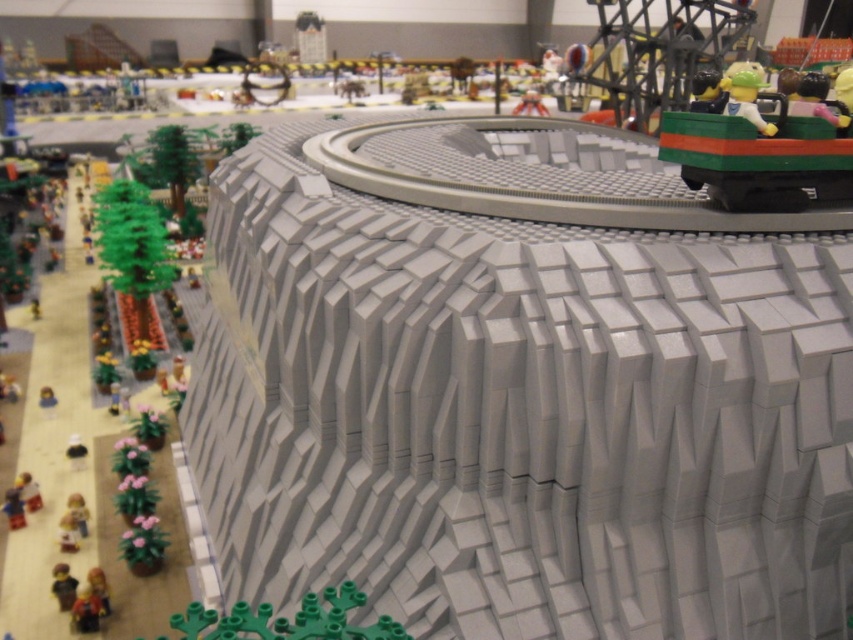
You are a visitor at a LEGO exhibition and see the green plastic car at upper right and the green matte figure at upper right. Which object is taller in this LEGO scene?

The green plastic car at upper right is taller than the green matte figure at upper right according to the description.

In the scene shown: You are examining a LEGO diorama and notice two points marked in the scene. The first point is at coordinates point (x=701, y=116) and the second is at point (x=534, y=108). Based on the LEGO model layout, which point is nearer to your viewpoint as you look at the image?

Point (x=701, y=116) is closer to the camera than point (x=534, y=108).

You are a visitor at a LEGO exhibition and see the LEGO model scene described. You notice a point marked at coordinates (746, 99). Which object in the scene does this point belong to?

The point at coordinates (746, 99) is located on the green matte figure at upper right.